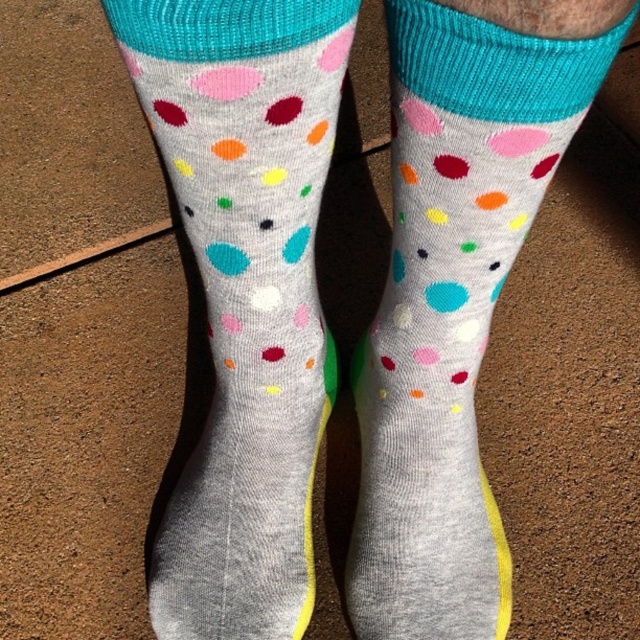
This screenshot has height=640, width=640. Find the location of `gray cotton socks at center`. gray cotton socks at center is located at coordinates (244, 292).